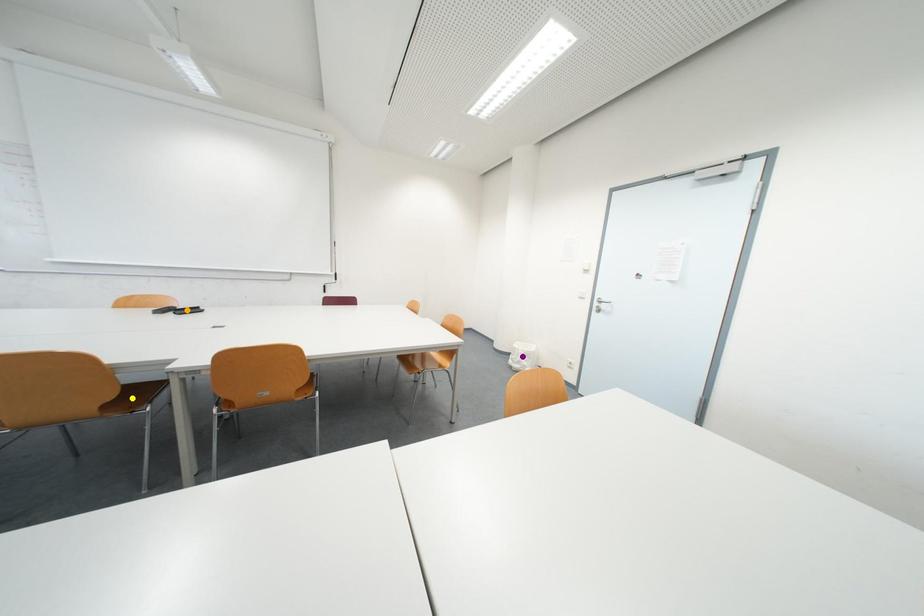
Order these from nearest to farthest:
orange point | yellow point | purple point

yellow point < orange point < purple point